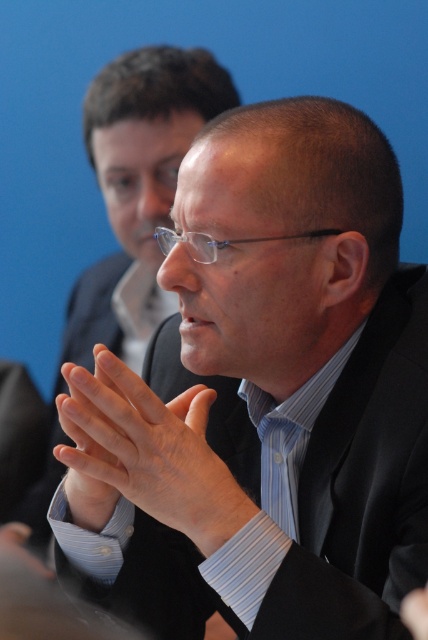
Consider the image. Measure the distance from matte black suit at center to black matte suit at center.

matte black suit at center and black matte suit at center are 4.42 inches apart from each other.

Which is behind, point (198, 125) or point (89, 324)?

Point (89, 324)

This screenshot has width=428, height=640. What are the coordinates of `matte black suit at center` in the screenshot? It's located at (137, 188).

Does matte black suit at center appear over smooth skin hands at center?

Indeed, matte black suit at center is positioned over smooth skin hands at center.

Does matte black suit at center have a lesser height compared to smooth skin hands at center?

In fact, matte black suit at center may be taller than smooth skin hands at center.

Between point (53, 429) and point (122, 492), which one is positioned behind?

Point (53, 429)

Find the location of a particular element. Image resolution: width=428 pixels, height=640 pixels. matte black suit at center is located at coordinates click(x=137, y=188).

Is point (56, 451) closer to camera compared to point (45, 486)?

That is True.

Which is in front, point (95, 392) or point (109, 316)?

Point (95, 392)

I want to click on smooth skin hands at center, so click(x=145, y=454).